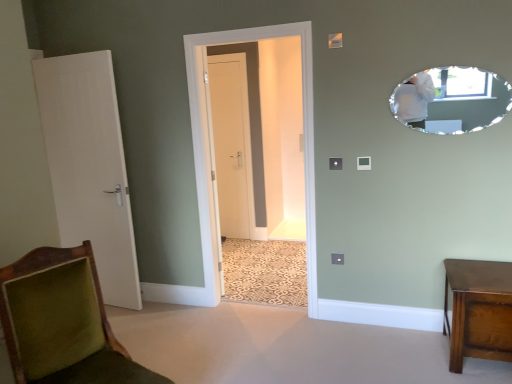
Question: Is oval-shaped mirror at upper right closer to camera compared to white matte door at center, the 1th door when ordered from right to left?

Choices:
 (A) no
 (B) yes

Answer: (B)

Question: Is oval-shaped mirror at upper right behind white matte door at center, the 1th door when ordered from right to left?

Choices:
 (A) yes
 (B) no

Answer: (B)

Question: Is oval-shaped mirror at upper right outside of white matte door at center, the 1th door when ordered from right to left?

Choices:
 (A) yes
 (B) no

Answer: (A)

Question: Is oval-shaped mirror at upper right shorter than white matte door at center, the first door when ordered from back to front?

Choices:
 (A) yes
 (B) no

Answer: (A)

Question: From the image's perspective, does oval-shaped mirror at upper right appear higher than white matte door at center, placed as the second door when sorted from left to right?

Choices:
 (A) yes
 (B) no

Answer: (A)

Question: Does oval-shaped mirror at upper right appear on the left side of white matte door at center, placed as the second door when sorted from left to right?

Choices:
 (A) yes
 (B) no

Answer: (B)

Question: Does oval-shaped mirror at upper right turn towards clear glass door at center?

Choices:
 (A) no
 (B) yes

Answer: (A)

Question: From a real-world perspective, is oval-shaped mirror at upper right physically below clear glass door at center?

Choices:
 (A) no
 (B) yes

Answer: (A)

Question: Can you confirm if oval-shaped mirror at upper right is thinner than clear glass door at center?

Choices:
 (A) yes
 (B) no

Answer: (A)

Question: From the image's perspective, is oval-shaped mirror at upper right under clear glass door at center?

Choices:
 (A) yes
 (B) no

Answer: (B)

Question: Does oval-shaped mirror at upper right have a greater height compared to clear glass door at center?

Choices:
 (A) yes
 (B) no

Answer: (B)

Question: Can you confirm if oval-shaped mirror at upper right is smaller than clear glass door at center?

Choices:
 (A) no
 (B) yes

Answer: (B)

Question: Does velvet green chair at lower left have a lesser height compared to shiny brown wooden side table at lower right?

Choices:
 (A) yes
 (B) no

Answer: (B)